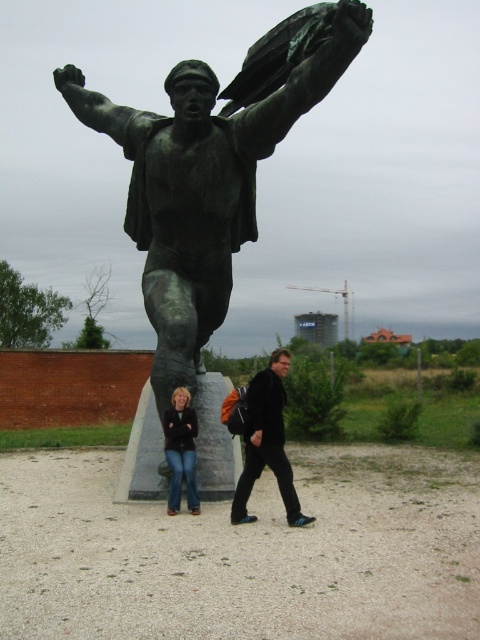
You are a photographer trying to capture a photo of the bronze statue at center and the black matte jacket at center. Since you want to ensure both are clearly visible, which object should you focus on first to ensure proper focus, considering their sizes?

The bronze statue at center is larger in size than the black matte jacket at center, so you should focus on the bronze statue at center first to ensure proper focus since it occupies more space in the frame.

You are standing at the point marked as point (266, 442) in the image. What object is exactly at this point?

The black matte jacket at center is located at point (266, 442).

You are standing at the point closest to the statue. There are two points marked in the image, one at coordinates point (296, 86) and another at point (179, 506). Which point is farther away from your current position?

Point (179, 506) is farther away from your current position because it is in front of point (296, 86), which is closer to the statue.